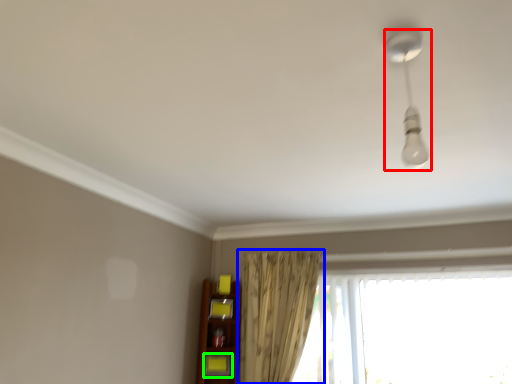
Question: Which object is the farthest from lamp (highlighted by a red box)? Choose among these: curtain (highlighted by a blue box) or shelf (highlighted by a green box).

Choices:
 (A) curtain
 (B) shelf

Answer: (B)